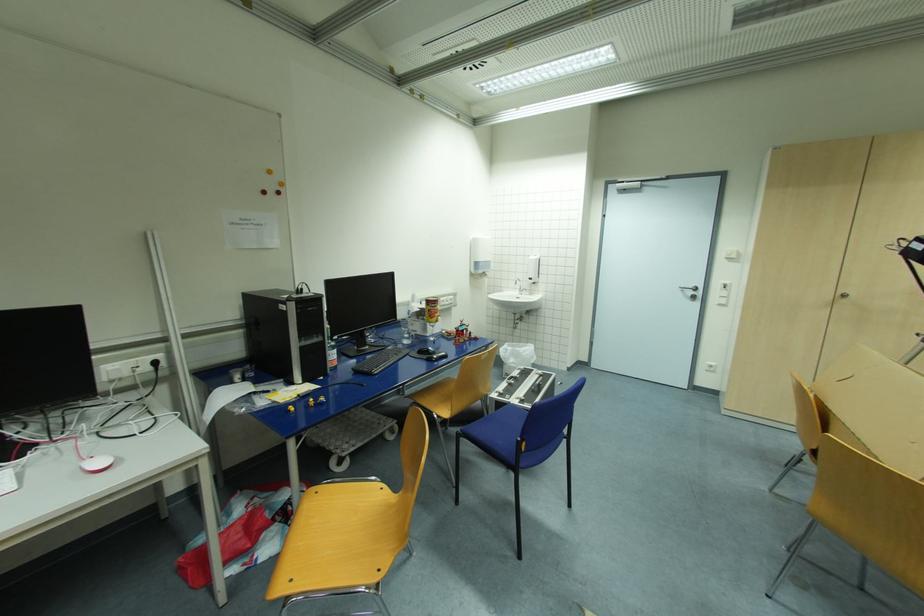
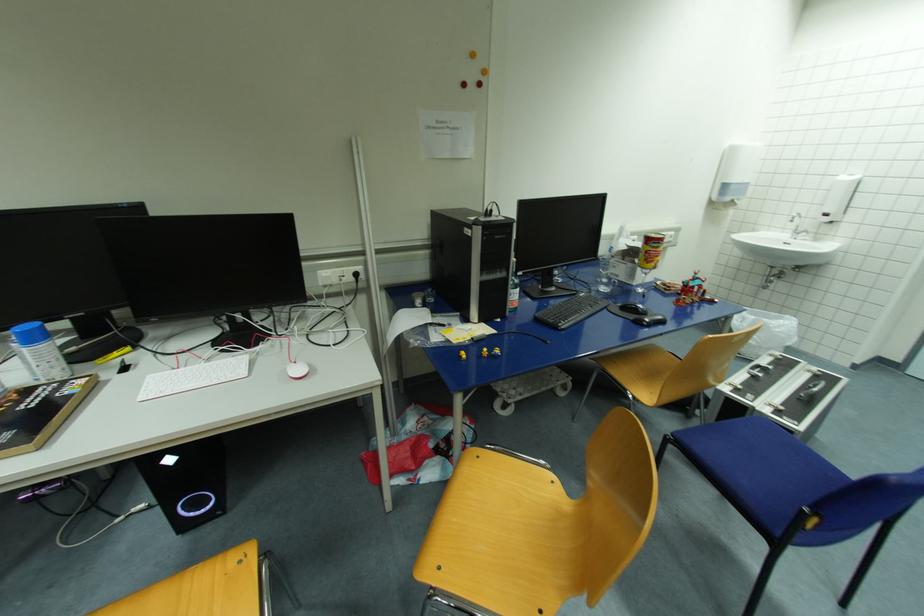
In the second image, find the point that corresponds to [525,291] in the first image.

(799, 233)